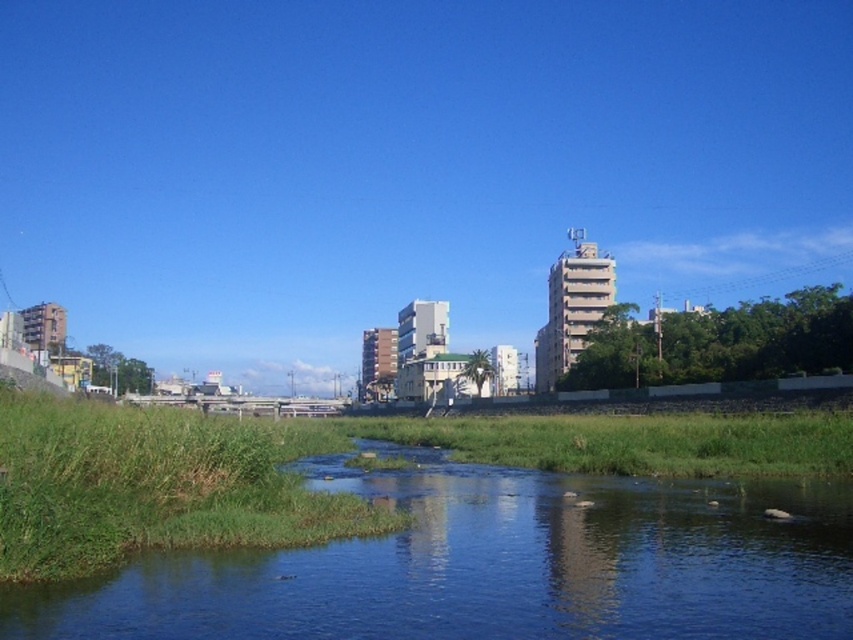
Is clear water at center taller than green grass at lower left?

No.

Between point (436, 467) and point (134, 440), which one is positioned behind?

Point (436, 467)

Find the location of a particular element. clear water at center is located at coordinates (495, 564).